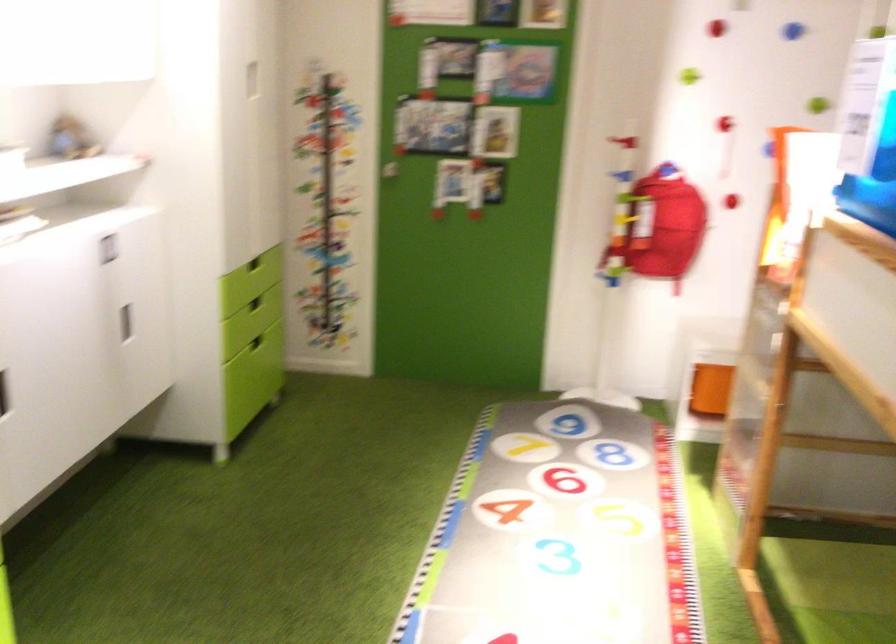
Image resolution: width=896 pixels, height=644 pixels. I want to click on orange plastic container, so click(x=710, y=389).